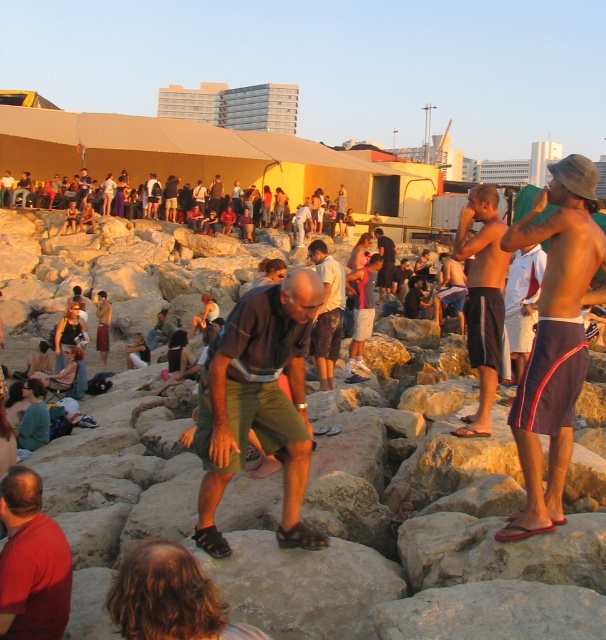
You are standing at the camera position and want to throw a frisbee to a friend. There are two points in the scene marked as point 1 at coordinates (565,362) and point 2 at coordinates (338,317). Which point is closer to you where you can throw the frisbee more accurately?

Point 1 at coordinates (565,362) is closer to the camera, so you can throw the frisbee more accurately to that point.

You are a photographer at the beach scene and want to capture both the red matte shirt at lower left and the dark blue shirt at center in your shot. Which shirt should you focus on first if you want to ensure both are in frame without moving the camera?

Result: You should focus on the red matte shirt at lower left first because it is bigger than the dark blue shirt at center, so capturing it first ensures it fits within the frame while the smaller dark blue shirt at center will naturally be included.

You are planning to set up a small picnic area for two people between the natural stone rocks at center and the matte yellow tent at upper center. Given the space between them, will there be enough room for the picnic setup?

The natural stone rocks at center are wider than the matte yellow tent at upper center, so there should be sufficient space between them to accommodate a picnic setup for two people.